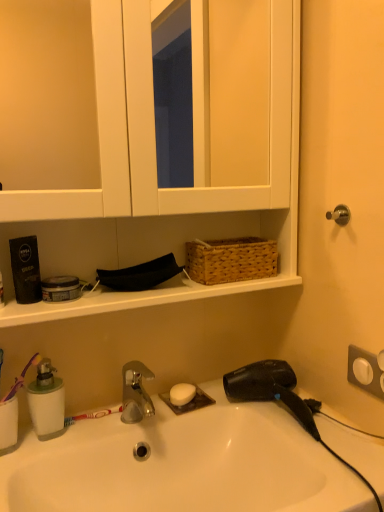
Locate an element on the screen. This screenshot has height=512, width=384. unoccupied region to the right of white matte soap at center is located at coordinates (249, 406).